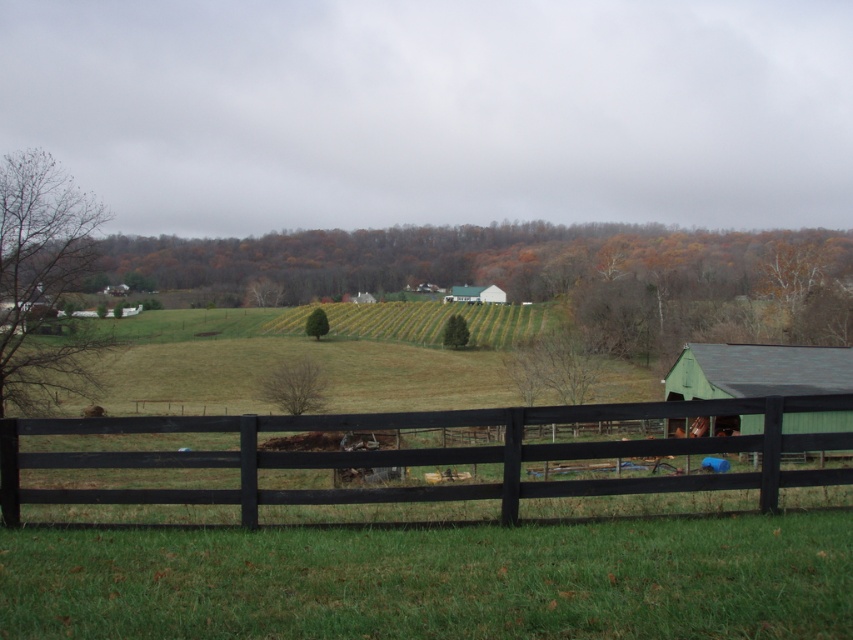
Question: Which point is farther to the camera?

Choices:
 (A) (460, 300)
 (B) (56, 458)
 (C) (761, 426)

Answer: (A)

Question: Where is black wood fence at lower center located in relation to green matte barn at right in the image?

Choices:
 (A) right
 (B) left

Answer: (B)

Question: In this image, where is black wood fence at lower center located relative to green matte barn at right?

Choices:
 (A) left
 (B) right

Answer: (A)

Question: Considering the real-world distances, which object is closest to the green matte barn at right?

Choices:
 (A) white matte barn at center
 (B) black wood fence at lower center

Answer: (B)

Question: Which of the following is the farthest from the observer?

Choices:
 (A) (699, 387)
 (B) (474, 300)
 (C) (766, 452)

Answer: (B)

Question: Can you confirm if black wood fence at lower center is positioned above green matte barn at right?

Choices:
 (A) yes
 (B) no

Answer: (B)